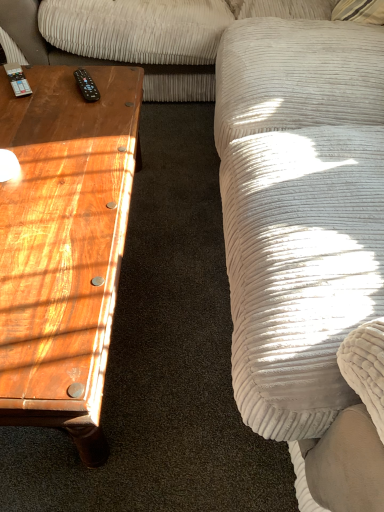
The image size is (384, 512). Find the location of `empty space that is ontop of wooden coffee table at left (from a real-world perspective)`. empty space that is ontop of wooden coffee table at left (from a real-world perspective) is located at coordinates (50, 153).